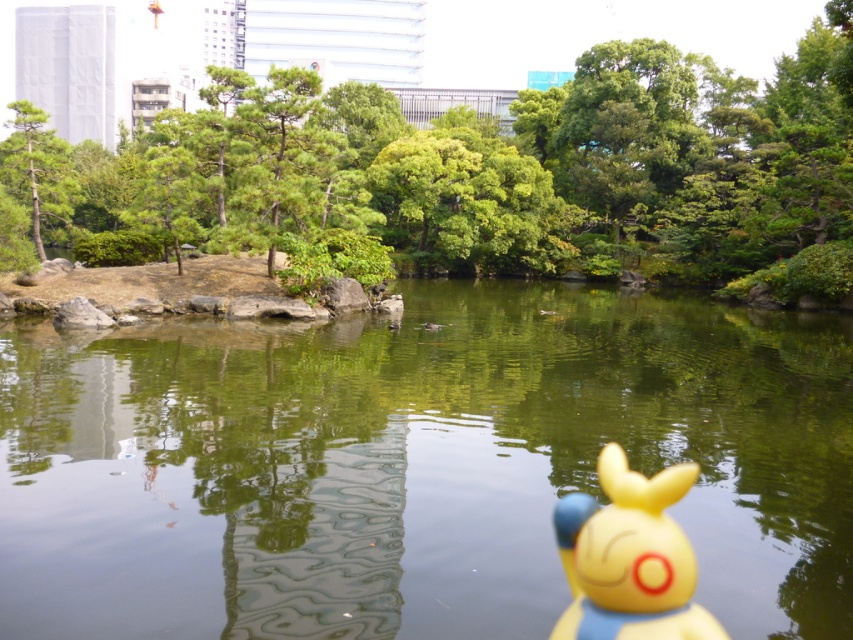
Between green leafy tree at upper center and yellow rubber duck at lower right, which one is positioned higher?

green leafy tree at upper center

Between point (601, 211) and point (622, 486), which one is positioned behind?

The point (601, 211) is behind.

I want to click on green leafy tree at upper center, so click(453, 157).

Does yellow rubber duck at lower right appear on the left side of green matte tree at upper left?

No, yellow rubber duck at lower right is not to the left of green matte tree at upper left.

Which is behind, point (656, 620) or point (6, 168)?

Point (6, 168)

Identify the location of yellow rubber duck at lower right. (630, 556).

Who is more distant from viewer, [215,360] or [413,225]?

The point [413,225] is more distant.

Is green reflective water at center above green leafy tree at upper center?

Actually, green reflective water at center is below green leafy tree at upper center.

Is point (706, 604) positioned in front of point (653, 202)?

Yes, it is in front of point (653, 202).

Where is `green reflective water at center`? The image size is (853, 640). green reflective water at center is located at coordinates (416, 465).